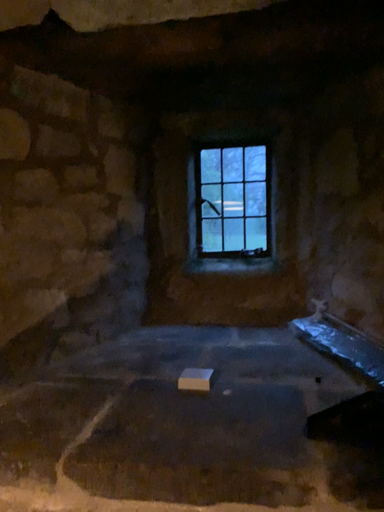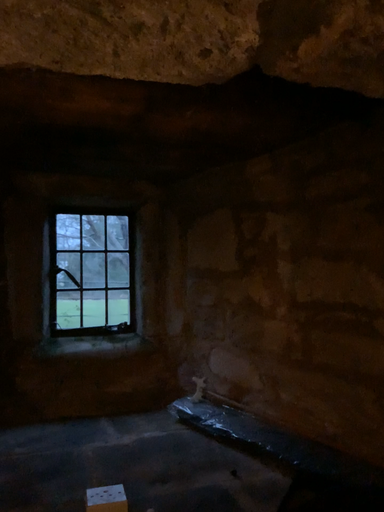
Question: Which way did the camera rotate in the video?

Choices:
 (A) rotated left
 (B) rotated right

Answer: (B)